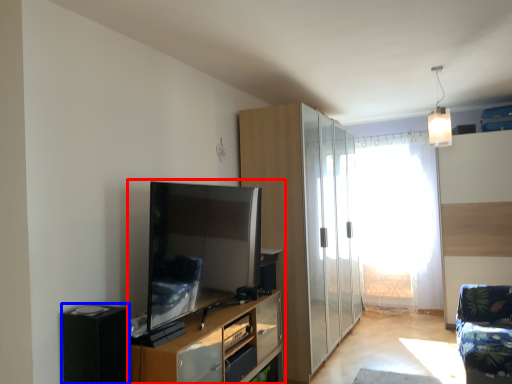
Question: Which object appears closest to the camera in this image, entertainment center (highlighted by a red box) or appliance (highlighted by a blue box)?

Choices:
 (A) entertainment center
 (B) appliance

Answer: (B)